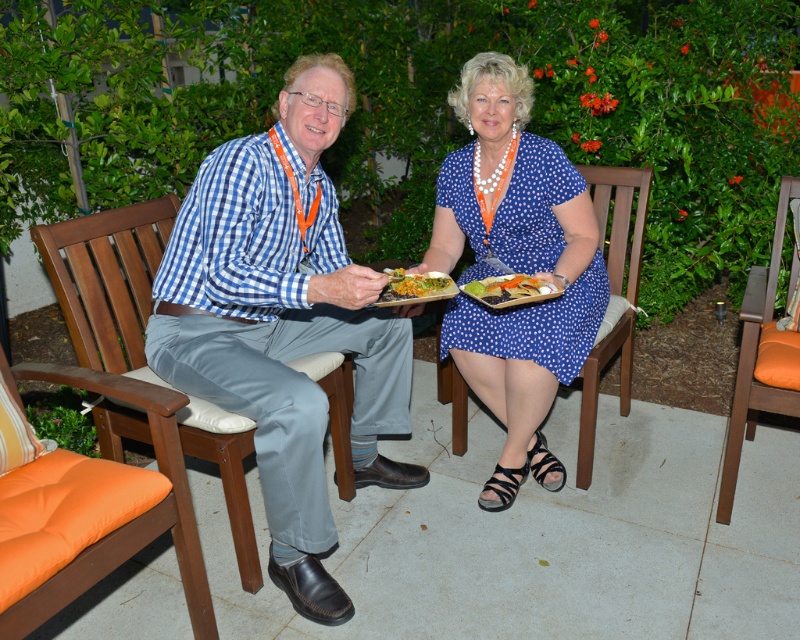
You are a photographer setting up a shot of the blue dotted dress at center and the orange fabric cushion at lower right. Which object should you focus on first if you want to capture the one closer to the camera?

The blue dotted dress at center is taller than the orange fabric cushion at lower right, so focusing on the blue dotted dress at center first would ensure capturing the closer object.